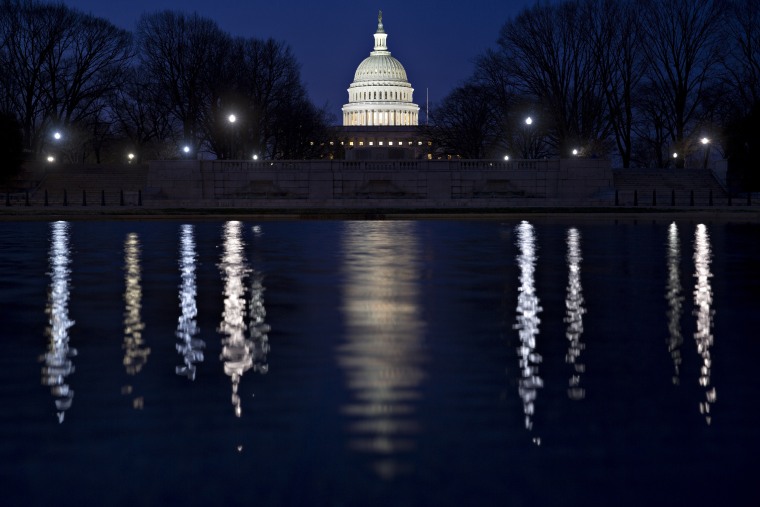
Identify the location of yellow light reflections. This screenshot has width=760, height=507. (131, 318), (232, 313), (705, 301).